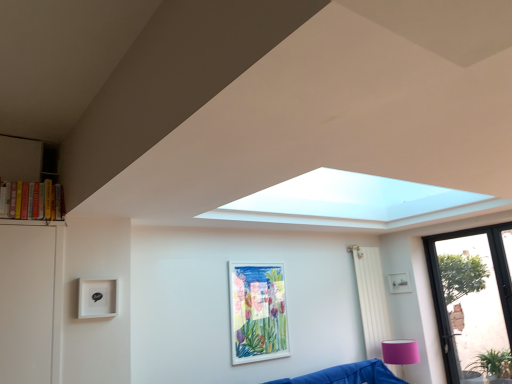
Locate an element on the screen. The width and height of the screenshot is (512, 384). hardcover books at left is located at coordinates (27, 182).

Image resolution: width=512 pixels, height=384 pixels. What do you see at coordinates (399, 283) in the screenshot? I see `matte white picture frame at upper right, acting as the second picture frame starting from the left` at bounding box center [399, 283].

Describe the element at coordinates (371, 298) in the screenshot. The width and height of the screenshot is (512, 384). I see `white fabric curtain at right` at that location.

Identify the location of transparent glass door at lower right. This screenshot has width=512, height=384. (473, 302).

Measure the distance between white matte picture frame at center, marked as the first picture frame in a front-to-back arrangement, and camera.

3.55 meters.

The image size is (512, 384). I want to click on hardcover books at left, so click(x=27, y=182).

Is matte white picture frame at upper right, the second picture frame when ordered from front to back, wider than hardcover books at left?

In fact, matte white picture frame at upper right, the second picture frame when ordered from front to back, might be narrower than hardcover books at left.

Is hardcover books at left inside matte white picture frame at upper right, the second picture frame when ordered from front to back?

No, hardcover books at left is not surrounded by matte white picture frame at upper right, the second picture frame when ordered from front to back.

Considering the positions of point (403, 291) and point (30, 200), is point (403, 291) closer or farther from the camera than point (30, 200)?

Point (403, 291).

How far apart are white fabric curtain at right and hardcover books at left?

white fabric curtain at right is 3.28 meters from hardcover books at left.

Does white fabric curtain at right have a smaller size compared to hardcover books at left?

No, white fabric curtain at right is not smaller than hardcover books at left.

Between white fabric curtain at right and hardcover books at left, which one has less height?

With less height is hardcover books at left.

From a real-world perspective, does white matte picture frame at center, which appears as the 2th picture frame when viewed from the back, sit lower than matte white picture frame at upper right, the second picture frame when ordered from front to back?

Yes, from a real-world perspective, white matte picture frame at center, which appears as the 2th picture frame when viewed from the back, is beneath matte white picture frame at upper right, the second picture frame when ordered from front to back.

Consider the image. Is white matte picture frame at center, which appears as the 2th picture frame when viewed from the back, positioned far away from matte white picture frame at upper right, acting as the second picture frame starting from the left?

Yes, white matte picture frame at center, which appears as the 2th picture frame when viewed from the back, and matte white picture frame at upper right, acting as the second picture frame starting from the left, are quite far apart.

Can you tell me how much white matte picture frame at center, which is counted as the 1th picture frame, starting from the left, and matte white picture frame at upper right, acting as the second picture frame starting from the left, differ in facing direction?

The angle between the facing direction of white matte picture frame at center, which is counted as the 1th picture frame, starting from the left, and the facing direction of matte white picture frame at upper right, acting as the second picture frame starting from the left, is 91.1 degrees.

Does white matte picture frame at center, which is counted as the 1th picture frame, starting from the left, have a lesser width compared to matte white picture frame at upper right, the first picture frame from the back?

No, white matte picture frame at center, which is counted as the 1th picture frame, starting from the left, is not thinner than matte white picture frame at upper right, the first picture frame from the back.

Which of these two, pink fabric lampshade at lower right or white matte picture frame at center, which appears as the 2th picture frame when viewed from the back, stands shorter?

Standing shorter between the two is pink fabric lampshade at lower right.

Is pink fabric lampshade at lower right located outside white matte picture frame at center, which appears as the 2th picture frame when viewed from the back?

Yes, pink fabric lampshade at lower right is located beyond the bounds of white matte picture frame at center, which appears as the 2th picture frame when viewed from the back.

Is pink fabric lampshade at lower right far from white matte picture frame at center, marked as the 2th picture frame in a right-to-left arrangement?

That's right, there is a large distance between pink fabric lampshade at lower right and white matte picture frame at center, marked as the 2th picture frame in a right-to-left arrangement.

Is pink fabric lampshade at lower right oriented away from white matte picture frame at center, which appears as the 2th picture frame when viewed from the back?

pink fabric lampshade at lower right is not turned away from white matte picture frame at center, which appears as the 2th picture frame when viewed from the back.

Are hardcover books at left and white fabric curtain at right far apart?

hardcover books at left is far away from white fabric curtain at right.

Between hardcover books at left and white fabric curtain at right, which one is positioned behind?

white fabric curtain at right is further away from the camera.

Considering the sizes of objects hardcover books at left and white fabric curtain at right in the image provided, who is thinner, hardcover books at left or white fabric curtain at right?

With smaller width is hardcover books at left.

Does point (403, 376) lie behind point (458, 319)?

No, it is in front of (458, 319).

Find the location of a particular element. window in front of the pink fabric lampshade at lower right is located at coordinates (473, 302).

From a real-world perspective, which is physically below, pink fabric lampshade at lower right or transparent glass door at lower right?

In real-world perspective, pink fabric lampshade at lower right is lower.

Can you confirm if white fabric curtain at right is thinner than matte white picture frame at upper right, acting as the second picture frame starting from the left?

In fact, white fabric curtain at right might be wider than matte white picture frame at upper right, acting as the second picture frame starting from the left.

Does white fabric curtain at right turn towards matte white picture frame at upper right, the second picture frame when ordered from front to back?

No, white fabric curtain at right is not oriented towards matte white picture frame at upper right, the second picture frame when ordered from front to back.

Based on the photo, from the image's perspective, between white fabric curtain at right and matte white picture frame at upper right, the first picture frame from the back, who is located below?

From the image's view, white fabric curtain at right is below.

Consider the image. Considering the positions of objects white fabric curtain at right and matte white picture frame at upper right, positioned as the first picture frame in right-to-left order, in the image provided, who is more to the right, white fabric curtain at right or matte white picture frame at upper right, positioned as the first picture frame in right-to-left order,?

matte white picture frame at upper right, positioned as the first picture frame in right-to-left order.

Where is `the 2nd picture frame to the right when counting from the hardcover books at left`? The height and width of the screenshot is (384, 512). the 2nd picture frame to the right when counting from the hardcover books at left is located at coordinates (399, 283).

Where is `bookcase above the white fabric curtain at right (from a real-world perspective)`? The width and height of the screenshot is (512, 384). bookcase above the white fabric curtain at right (from a real-world perspective) is located at coordinates (27, 182).

From the picture: Looking at the image, which one is located further to hardcover books at left, white matte picture frame at center, marked as the first picture frame in a front-to-back arrangement, or pink fabric lampshade at lower right?

pink fabric lampshade at lower right is further to hardcover books at left.

Estimate the real-world distances between objects in this image. Which object is further from matte white picture frame at upper right, positioned as the first picture frame in right-to-left order, transparent glass door at lower right or hardcover books at left?

hardcover books at left lies further to matte white picture frame at upper right, positioned as the first picture frame in right-to-left order, than the other object.

Considering their positions, is matte white picture frame at upper right, acting as the second picture frame starting from the left, positioned closer to white fabric curtain at right than transparent glass door at lower right?

Among the two, matte white picture frame at upper right, acting as the second picture frame starting from the left, is located nearer to white fabric curtain at right.

Considering their positions, is transparent glass door at lower right positioned further to white fabric curtain at right than hardcover books at left?

The object further to white fabric curtain at right is hardcover books at left.

Based on their spatial positions, is transparent glass door at lower right or white fabric curtain at right further from matte white picture frame at upper right, the second picture frame when ordered from front to back?

transparent glass door at lower right lies further to matte white picture frame at upper right, the second picture frame when ordered from front to back, than the other object.

Estimate the real-world distances between objects in this image. Which object is further from transparent glass door at lower right, matte white picture frame at upper right, acting as the second picture frame starting from the left, or hardcover books at left?

hardcover books at left is further to transparent glass door at lower right.

Estimate the real-world distances between objects in this image. Which object is further from pink fabric lampshade at lower right, white matte picture frame at center, which appears as the 2th picture frame when viewed from the back, or hardcover books at left?

The object further to pink fabric lampshade at lower right is hardcover books at left.

Looking at the image, which one is located closer to transparent glass door at lower right, pink fabric lampshade at lower right or white fabric curtain at right?

pink fabric lampshade at lower right is closer to transparent glass door at lower right.

Image resolution: width=512 pixels, height=384 pixels. In order to click on curtain situated between hardcover books at left and pink fabric lampshade at lower right from left to right in this screenshot , I will do `click(371, 298)`.

Image resolution: width=512 pixels, height=384 pixels. Find the location of `curtain between matte white picture frame at upper right, the second picture frame when ordered from front to back, and pink fabric lampshade at lower right vertically`. curtain between matte white picture frame at upper right, the second picture frame when ordered from front to back, and pink fabric lampshade at lower right vertically is located at coordinates (371, 298).

The height and width of the screenshot is (384, 512). In order to click on lamp located between white fabric curtain at right and transparent glass door at lower right in the left-right direction in this screenshot , I will do `click(400, 353)`.

The image size is (512, 384). I want to click on picture frame located between pink fabric lampshade at lower right and transparent glass door at lower right in the left-right direction, so click(x=399, y=283).